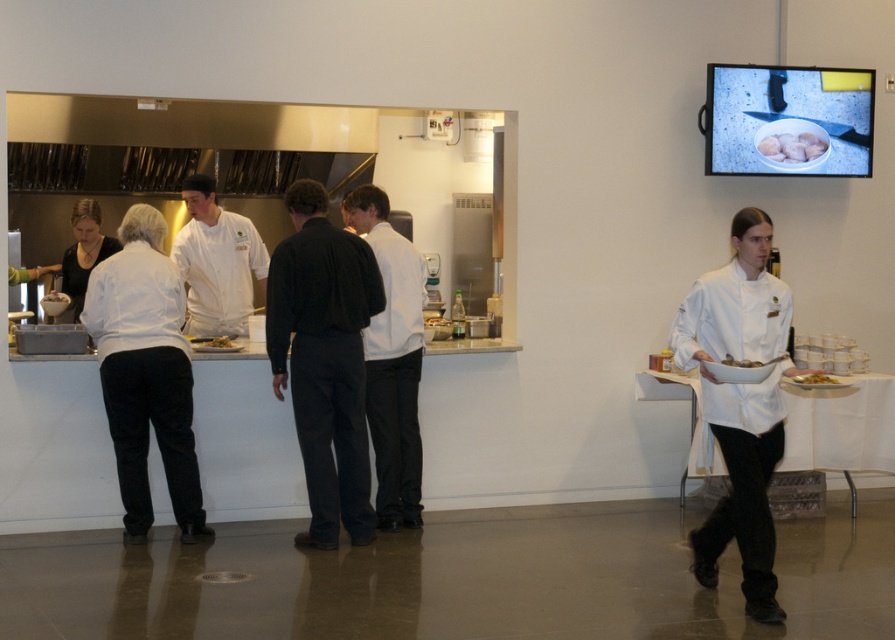
Can you confirm if white matte uniform at right is wider than matte white plate at center?

Yes.

Describe the element at coordinates (739, 404) in the screenshot. The width and height of the screenshot is (895, 640). I see `white matte uniform at right` at that location.

Does point (743, 589) come closer to viewer compared to point (54, 300)?

Yes, point (743, 589) is in front of point (54, 300).

Identify the location of white matte uniform at right. This screenshot has height=640, width=895. (x=739, y=404).

Looking at this image, does white glossy bowl at right have a smaller size compared to matte white plate at center?

Correct, white glossy bowl at right occupies less space than matte white plate at center.

Does point (727, 356) come closer to viewer compared to point (48, 292)?

Yes, it is in front of point (48, 292).

Where is `white glossy bowl at right`? white glossy bowl at right is located at coordinates (740, 362).

Is point (766, 138) closer to viewer compared to point (833, 376)?

No, it is not.

Which is behind, point (765, 145) or point (834, 385)?

The point (765, 145) is more distant.

Identify the location of white glossy chicken at upper right. (791, 147).